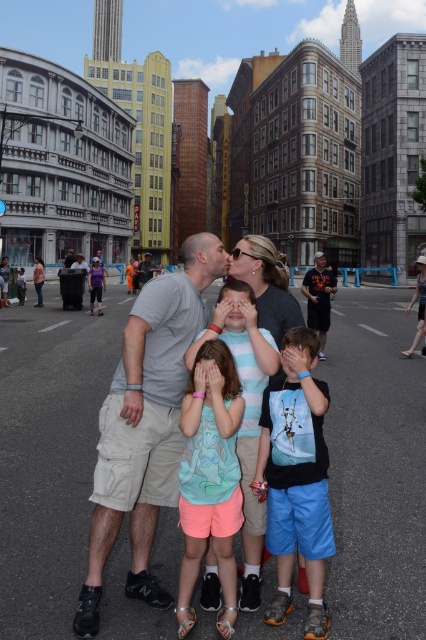
Question: Where is orange t-shirt at center located in relation to matte gray t-shirt at center in the image?

Choices:
 (A) right
 (B) left

Answer: (A)

Question: Which object is positioned closest to the gray cotton t-shirt at center?

Choices:
 (A) light blue cotton shirt at center
 (B) black matte shirt at center

Answer: (A)

Question: Can you confirm if orange t-shirt at center is bigger than matte gray t-shirt at center?

Choices:
 (A) no
 (B) yes

Answer: (B)

Question: Which point is farther to the camera?

Choices:
 (A) orange t-shirt at center
 (B) matte gray t-shirt at center
 (C) black matte shirt at center

Answer: (B)

Question: Does black matte shirt at center appear on the right side of matte gray t-shirt at center?

Choices:
 (A) no
 (B) yes

Answer: (B)

Question: Among these objects, which one is nearest to the camera?

Choices:
 (A) light blue cotton shirt at center
 (B) black matte shirt at center
 (C) orange t-shirt at center
 (D) gray cotton t-shirt at center

Answer: (A)